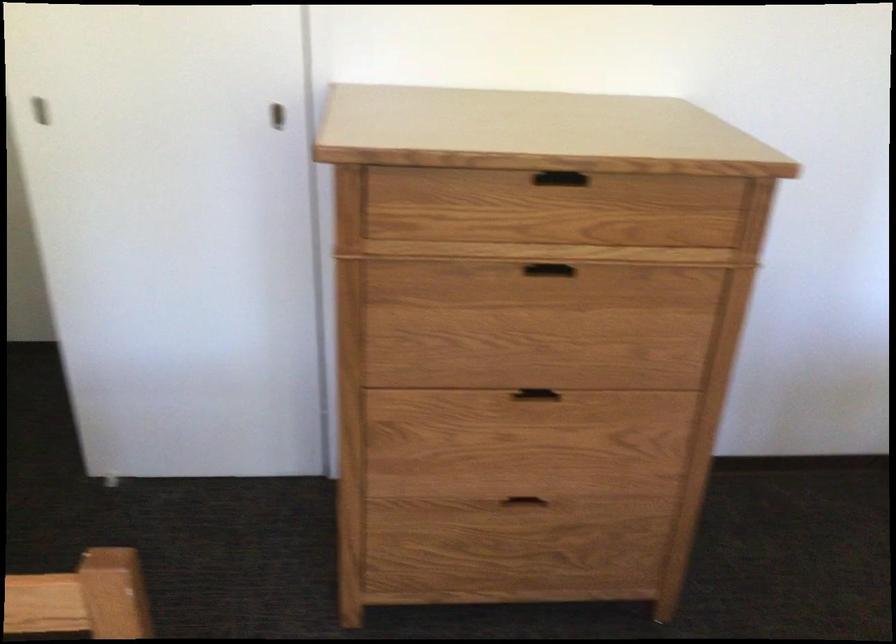
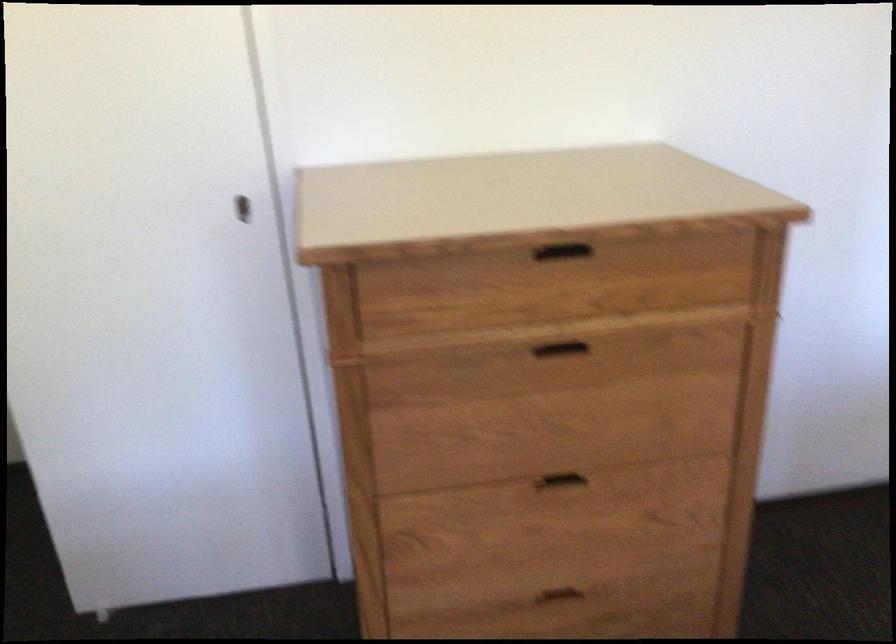
The images are taken continuously from a first-person perspective. In which direction are you moving?

The movement direction of the cameraman is left, forward.